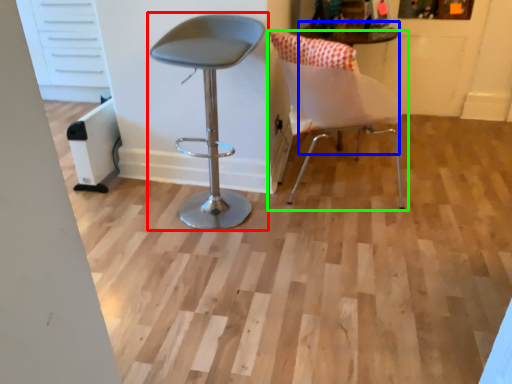
Question: Which is nearer to the chair (highlighted by a red box)? round table (highlighted by a blue box) or chair (highlighted by a green box).

Choices:
 (A) round table
 (B) chair

Answer: (B)